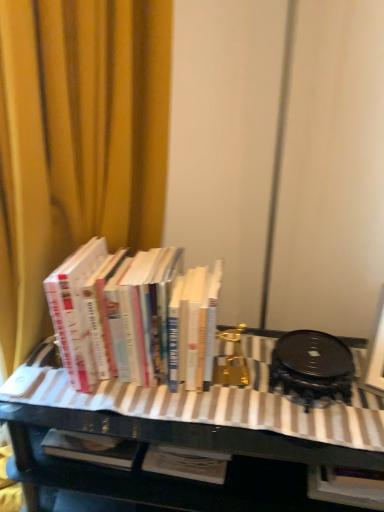
Question: Is yellow fabric curtain at upper left taller than black glossy table at center?

Choices:
 (A) yes
 (B) no

Answer: (A)

Question: Is yellow fabric curtain at upper left at the left side of black glossy table at center?

Choices:
 (A) no
 (B) yes

Answer: (B)

Question: Considering the relative sizes of yellow fabric curtain at upper left and black glossy table at center in the image provided, is yellow fabric curtain at upper left bigger than black glossy table at center?

Choices:
 (A) yes
 (B) no

Answer: (A)

Question: Is yellow fabric curtain at upper left shorter than black glossy table at center?

Choices:
 (A) no
 (B) yes

Answer: (A)

Question: Is yellow fabric curtain at upper left positioned before black glossy table at center?

Choices:
 (A) no
 (B) yes

Answer: (B)

Question: Is yellow fabric curtain at upper left not within black glossy table at center?

Choices:
 (A) yes
 (B) no

Answer: (A)

Question: From the image's perspective, is black glossy table at center under yellow fabric curtain at upper left?

Choices:
 (A) yes
 (B) no

Answer: (A)

Question: Is black glossy table at center facing away from yellow fabric curtain at upper left?

Choices:
 (A) no
 (B) yes

Answer: (A)

Question: Considering the relative sizes of black glossy table at center and yellow fabric curtain at upper left in the image provided, is black glossy table at center shorter than yellow fabric curtain at upper left?

Choices:
 (A) yes
 (B) no

Answer: (A)

Question: Can you confirm if black glossy table at center is taller than yellow fabric curtain at upper left?

Choices:
 (A) no
 (B) yes

Answer: (A)

Question: Can you confirm if black glossy table at center is smaller than yellow fabric curtain at upper left?

Choices:
 (A) no
 (B) yes

Answer: (B)

Question: Is the depth of black glossy table at center greater than that of yellow fabric curtain at upper left?

Choices:
 (A) no
 (B) yes

Answer: (B)

Question: Could you tell me if hardcover books at left is turned towards black glossy table at center?

Choices:
 (A) yes
 (B) no

Answer: (B)